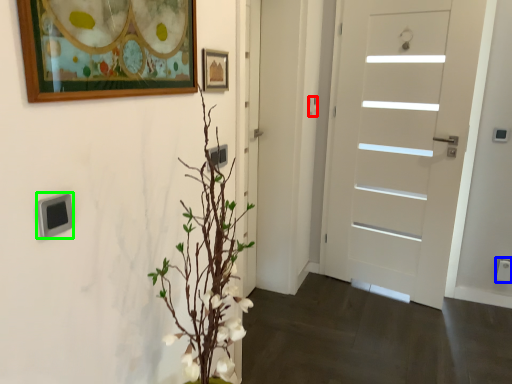
Question: Which is nearer to the door handle (highlighted by a red box)? electric outlet (highlighted by a blue box) or light switch (highlighted by a green box).

Choices:
 (A) electric outlet
 (B) light switch

Answer: (A)